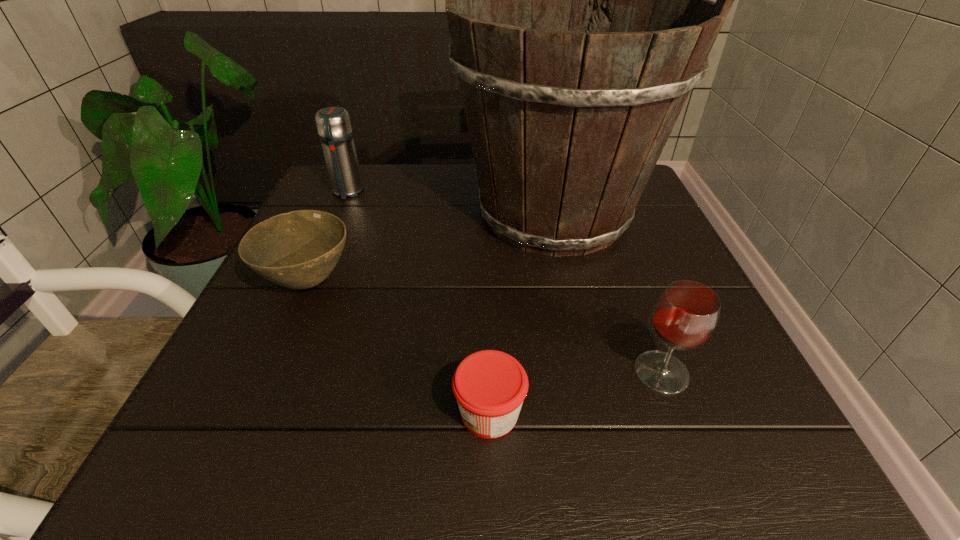
Find the location of a particular element. Image resolution: width=960 pixels, height=540 pixels. vacant area situated 0.230m on the label side of the shortest object is located at coordinates (292, 413).

Locate an element on the screen. This screenshot has height=540, width=960. free spot located on the label side of the shortest object is located at coordinates (207, 413).

Find the location of `bucket that is at the far edge`. bucket that is at the far edge is located at coordinates (567, 118).

The width and height of the screenshot is (960, 540). Identify the location of thermos bottle positioned at the far edge. (335, 132).

You are a GUI agent. You are given a task and a screenshot of the screen. Output one action in this format:
    pyautogui.click(x=<x>, y=<y>)
    Task: Click on the object located at the near edge
    This screenshot has height=540, width=960.
    Given the screenshot: What is the action you would take?
    pyautogui.click(x=490, y=386)

Identify the location of thermos bottle located at the left edge. (335, 132).

This screenshot has height=540, width=960. What are the coordinates of `bowl present at the left edge` in the screenshot? It's located at (299, 249).

Find the location of a particular element. This screenshot has height=540, width=960. bucket that is at the right edge is located at coordinates (567, 118).

Identify the location of wineglass that is at the right edge. The width and height of the screenshot is (960, 540). (685, 316).

Where is `object that is at the far left corner`? The height and width of the screenshot is (540, 960). object that is at the far left corner is located at coordinates (335, 132).